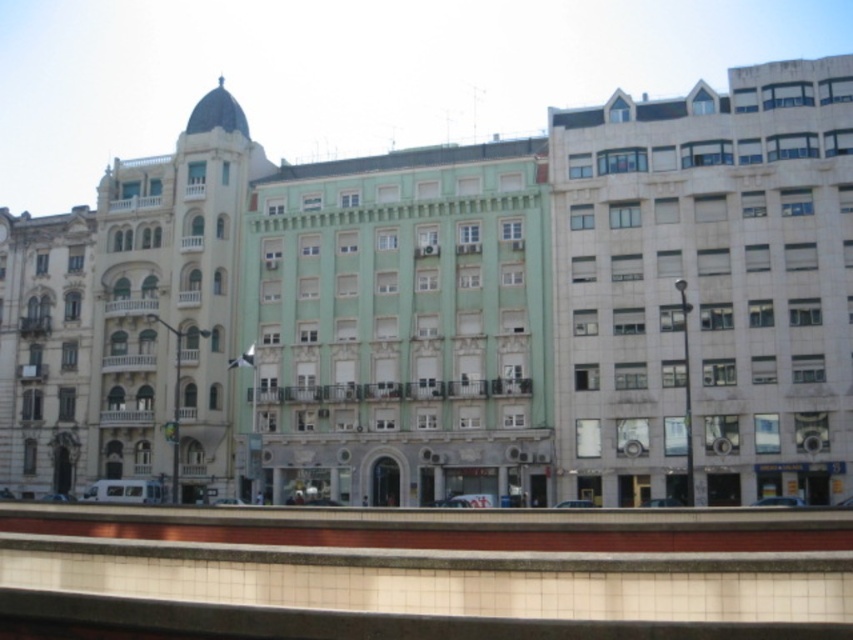
Question: Considering the relative positions of white marble building at right and green matte building at center in the image provided, where is white marble building at right located with respect to green matte building at center?

Choices:
 (A) right
 (B) left

Answer: (A)

Question: Which of the following is the closest to the observer?

Choices:
 (A) beige stone building at left
 (B) green stone building at center
 (C) green matte building at center
 (D) white marble building at right

Answer: (D)

Question: Among these points, which one is nearest to the camera?

Choices:
 (A) (289, 362)
 (B) (38, 385)
 (C) (128, 323)

Answer: (A)

Question: Which point is farther to the camera?

Choices:
 (A) beige stone building at left
 (B) green matte building at center
 (C) green stone building at center
 (D) white marble building at right

Answer: (A)

Question: Is green stone building at center to the right of white marble building at right from the viewer's perspective?

Choices:
 (A) yes
 (B) no

Answer: (B)

Question: Is green stone building at center further to camera compared to white marble building at right?

Choices:
 (A) yes
 (B) no

Answer: (A)